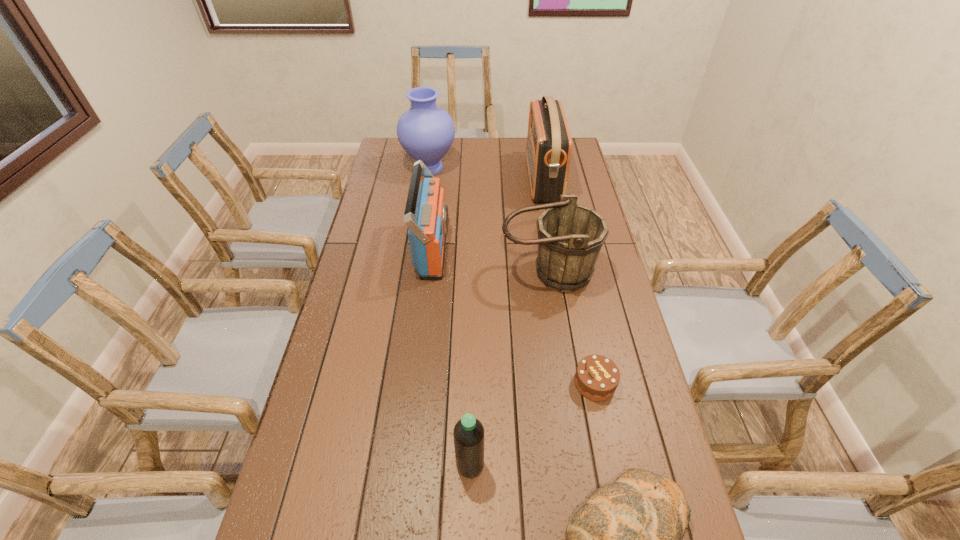
At what (x,y) coordinates should I click in order to perform the action: click on unoccupied position between the bucket and the vase. Please return your answer as a coordinate pair (x, y). This screenshot has width=960, height=540. Looking at the image, I should click on (489, 221).

Identify the location of free point between the shorter radio receiver and the shortest object. (514, 316).

Identify which object is the sixth nearest to the fifth farthest object. Please provide its 2D coordinates. Your answer should be formatted as a tuple, i.e. [(x, y)], where the tuple contains the x and y coordinates of a point satisfying the conditions above.

[(426, 132)]

Image resolution: width=960 pixels, height=540 pixels. Identify the location of object that stands as the fifth closest to the bucket. (468, 433).

Identify the location of vacant area that satisfies the following two spatial constraints: 1. on the front-facing side of the water bottle; 2. on the right side of the shorter radio receiver. Image resolution: width=960 pixels, height=540 pixels. (409, 465).

Identify the location of free space that satisfies the following two spatial constraints: 1. on the handle side of the fifth farthest object; 2. on the left side of the bucket. click(564, 383).